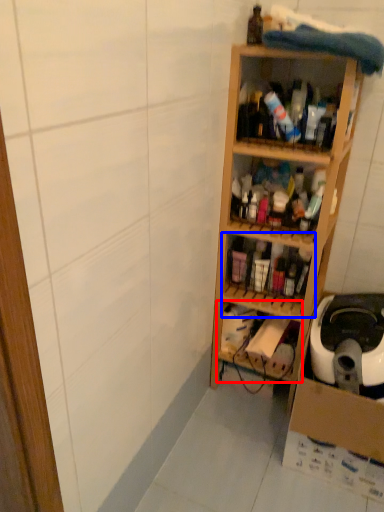
Question: Which object appears farthest to the camera in this image, shelf (highlighted by a red box) or shelf (highlighted by a blue box)?

Choices:
 (A) shelf
 (B) shelf

Answer: (B)